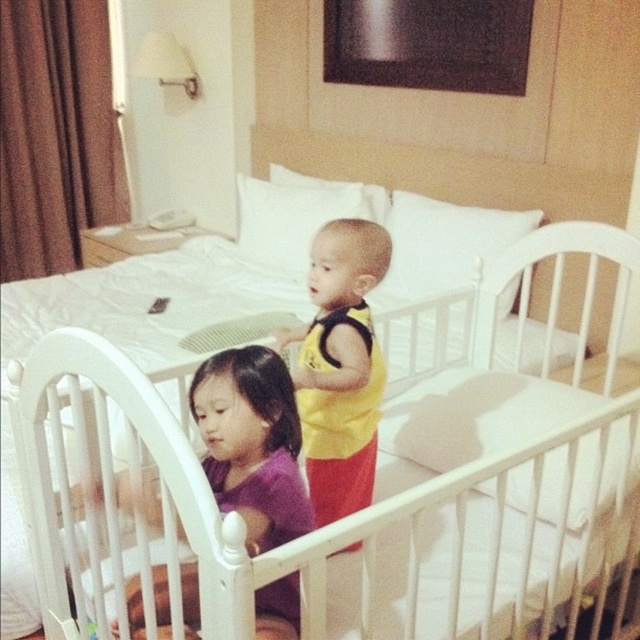
Question: Can you confirm if purple matte shirt at center is positioned below yellow fabric baby at center?

Choices:
 (A) yes
 (B) no

Answer: (A)

Question: Which point is closer to the camera?

Choices:
 (A) yellow fabric baby at center
 (B) purple matte shirt at center

Answer: (B)

Question: Which point is farther to the camera?

Choices:
 (A) purple matte shirt at center
 (B) yellow fabric baby at center

Answer: (B)

Question: Is purple matte shirt at center further to camera compared to yellow fabric baby at center?

Choices:
 (A) no
 (B) yes

Answer: (A)

Question: Observing the image, what is the correct spatial positioning of purple matte shirt at center in reference to yellow fabric baby at center?

Choices:
 (A) below
 (B) above

Answer: (A)